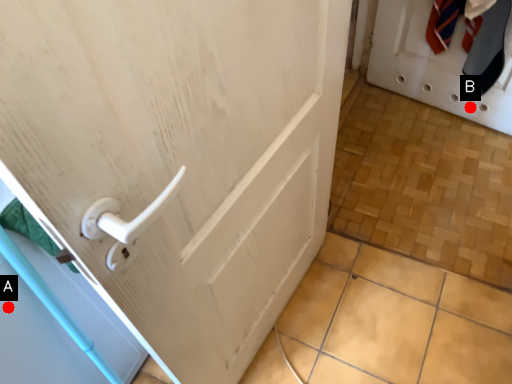
Question: Two points are circled on the image, labeled by A and B beside each circle. Which point appears farthest from the camera in this image?

Choices:
 (A) A is further
 (B) B is further

Answer: (B)